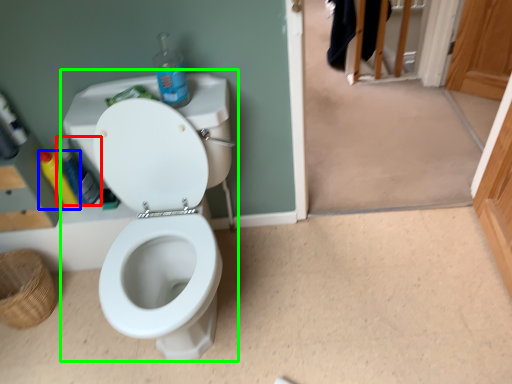
Question: Estimate the real-world distances between objects in this image. Which object is closer to bottle (highlighted by a red box), bottle (highlighted by a blue box) or sink (highlighted by a green box)?

Choices:
 (A) bottle
 (B) sink

Answer: (A)